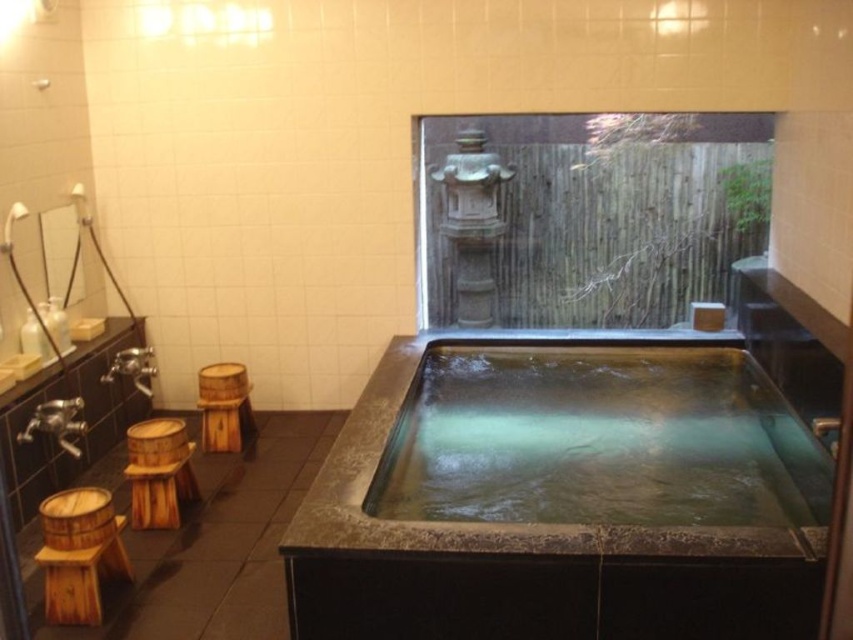
Between wooden stool at lower left and wooden at left, which one is positioned higher?

wooden at left is above.

Does wooden stool at lower left appear over wooden at left?

Incorrect, wooden stool at lower left is not positioned above wooden at left.

You are a GUI agent. You are given a task and a screenshot of the screen. Output one action in this format:
    pyautogui.click(x=<x>, y=<y>)
    Task: Click on the wooden stool at lower left
    
    Given the screenshot: What is the action you would take?
    pyautogui.click(x=158, y=472)

Between smooth stone bath at center and wooden barrel stool at lower left, which one has more height?

With more height is smooth stone bath at center.

Which of these two, smooth stone bath at center or wooden barrel stool at lower left, stands shorter?

wooden barrel stool at lower left

Where is `smooth stone bath at center`? The image size is (853, 640). smooth stone bath at center is located at coordinates (564, 496).

Can you confirm if smooth stone bath at center is wider than wooden at left?

Correct, the width of smooth stone bath at center exceeds that of wooden at left.

The width and height of the screenshot is (853, 640). Identify the location of smooth stone bath at center. (564, 496).

What are the coordinates of `smooth stone bath at center` in the screenshot? It's located at (564, 496).